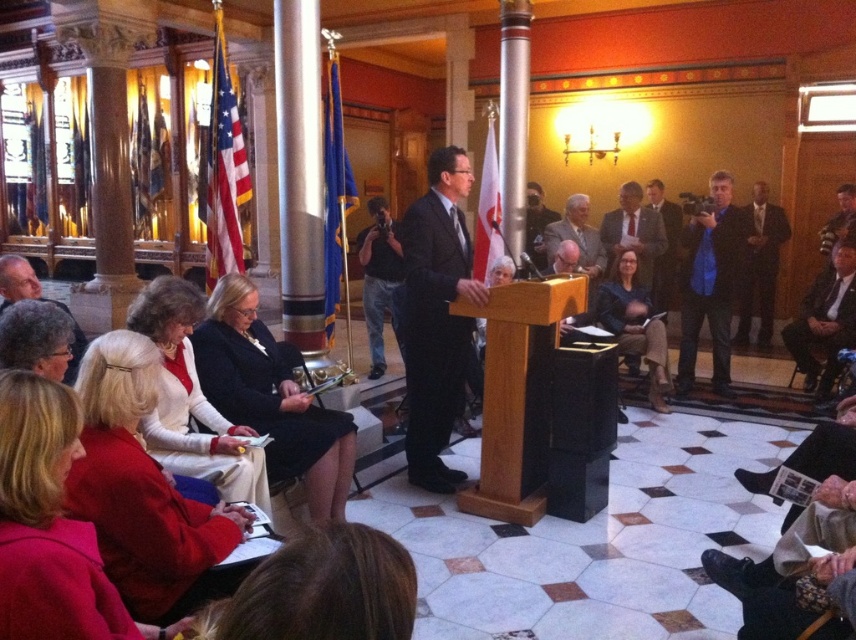
Can you confirm if blue fabric bag at right is wider than dark brown leather jacket at lower right?

Indeed, blue fabric bag at right has a greater width compared to dark brown leather jacket at lower right.

I want to click on blue fabric bag at right, so click(x=710, y=282).

Can you confirm if dark blue fabric jacket at center is bigger than dark suit jacket at right?

Yes, dark blue fabric jacket at center is bigger than dark suit jacket at right.

Describe the element at coordinates (634, 323) in the screenshot. I see `dark blue fabric jacket at center` at that location.

Find the location of a particular element. dark blue fabric jacket at center is located at coordinates (634, 323).

Is the position of black fabric dress at center less distant than that of matte black suit at upper right?

Yes, black fabric dress at center is in front of matte black suit at upper right.

Is black fabric dress at center thinner than matte black suit at upper right?

Yes, black fabric dress at center is thinner than matte black suit at upper right.

You are a GUI agent. You are given a task and a screenshot of the screen. Output one action in this format:
    pyautogui.click(x=<x>, y=<y>)
    Task: Click on the black fabric dress at center
    
    Given the screenshot: What is the action you would take?
    pyautogui.click(x=272, y=397)

The height and width of the screenshot is (640, 856). Identify the location of black fabric dress at center. (272, 397).